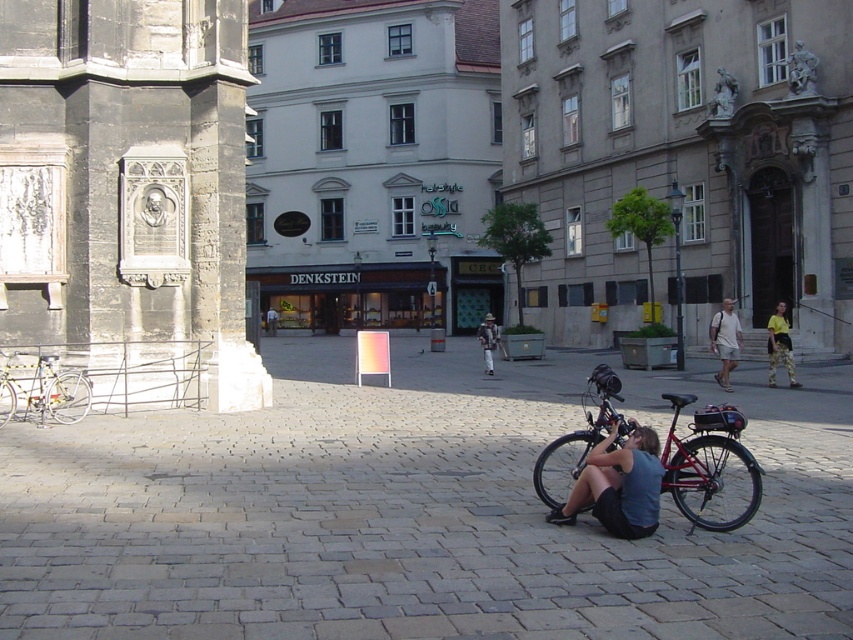
What do you see at coordinates (618, 484) in the screenshot? The image size is (853, 640). I see `metallic bicycle at center` at bounding box center [618, 484].

Is point (648, 465) behind point (709, 337)?

No, it is not.

You are a GUI agent. You are given a task and a screenshot of the screen. Output one action in this format:
    pyautogui.click(x=<x>, y=<y>)
    Task: Click on the metallic bicycle at center
    
    Given the screenshot: What is the action you would take?
    pyautogui.click(x=618, y=484)

Does shiny red bicycle at lower right come in front of light brown shorts at center?

Yes, shiny red bicycle at lower right is in front of light brown shorts at center.

Between shiny red bicycle at lower right and light brown shorts at center, which one has less height?

With less height is shiny red bicycle at lower right.

You are a GUI agent. You are given a task and a screenshot of the screen. Output one action in this format:
    pyautogui.click(x=<x>, y=<y>)
    Task: Click on the shiny red bicycle at lower right
    
    Given the screenshot: What is the action you would take?
    pyautogui.click(x=711, y=467)

Does silver metallic bicycle at left appear on the left side of yellow camouflage pants at right?

Correct, you'll find silver metallic bicycle at left to the left of yellow camouflage pants at right.

What are the coordinates of `silver metallic bicycle at left` in the screenshot? It's located at tap(41, 388).